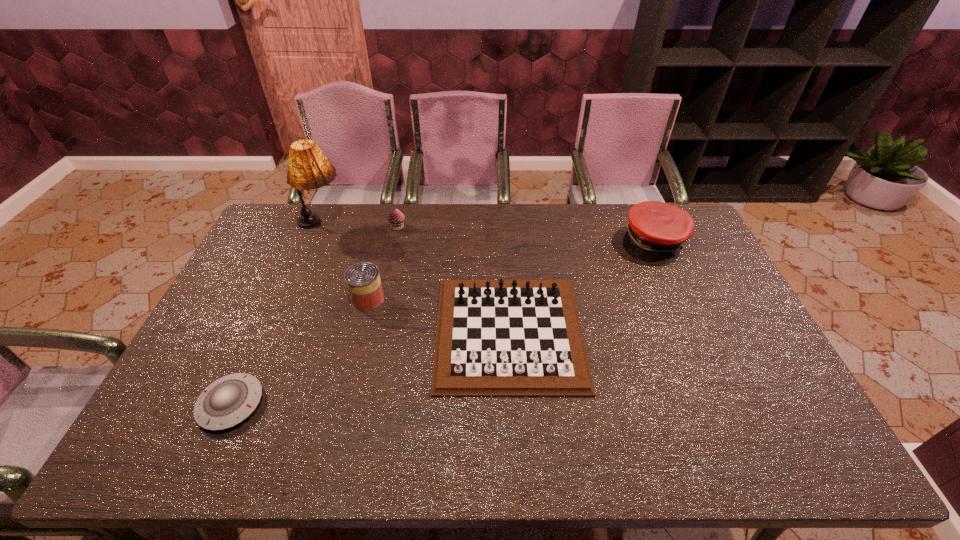
Identify the location of free point between the gameboard and the shortest object. (371, 368).

Find the location of a particular element. vacant area between the tallest object and the saucer is located at coordinates (276, 315).

Locate an element on the screen. This screenshot has width=960, height=540. free spot between the can and the shortest object is located at coordinates (300, 352).

Choose which object is the fourth nearest neighbor to the cupcake. Please provide its 2D coordinates. Your answer should be formatted as a tuple, i.e. [(x, y)], where the tuple contains the x and y coordinates of a point satisfying the conditions above.

[(229, 400)]

Select which object is the closest to the tallest object. Please provide its 2D coordinates. Your answer should be formatted as a tuple, i.e. [(x, y)], where the tuple contains the x and y coordinates of a point satisfying the conditions above.

[(396, 218)]

The width and height of the screenshot is (960, 540). Identify the location of vacant space that satisfies the following two spatial constraints: 1. on the front-facing side of the lampshade; 2. on the left side of the cupcake. (322, 227).

The width and height of the screenshot is (960, 540). I want to click on vacant area in the image that satisfies the following two spatial constraints: 1. on the back side of the gameboard; 2. on the left side of the saucer, so click(263, 332).

Where is `vacant position in the image that satisfies the following two spatial constraints: 1. on the back side of the shortest object; 2. on the right side of the cupcake`? The height and width of the screenshot is (540, 960). vacant position in the image that satisfies the following two spatial constraints: 1. on the back side of the shortest object; 2. on the right side of the cupcake is located at coordinates (311, 227).

Find the location of a particular element. free space that satisfies the following two spatial constraints: 1. on the back side of the cupcake; 2. on the front-facing side of the tallest object is located at coordinates (398, 225).

The height and width of the screenshot is (540, 960). In order to click on vacant space that satisfies the following two spatial constraints: 1. on the front-facing side of the lampshade; 2. on the left side of the can in this screenshot , I will do `click(292, 299)`.